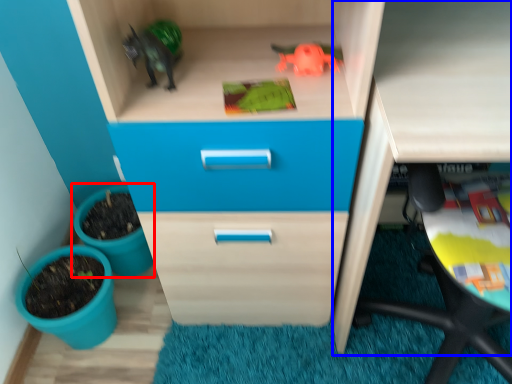
Question: Among these objects, which one is farthest to the camera, flowerpot (highlighted by a red box) or computer desk (highlighted by a blue box)?

Choices:
 (A) flowerpot
 (B) computer desk

Answer: (A)